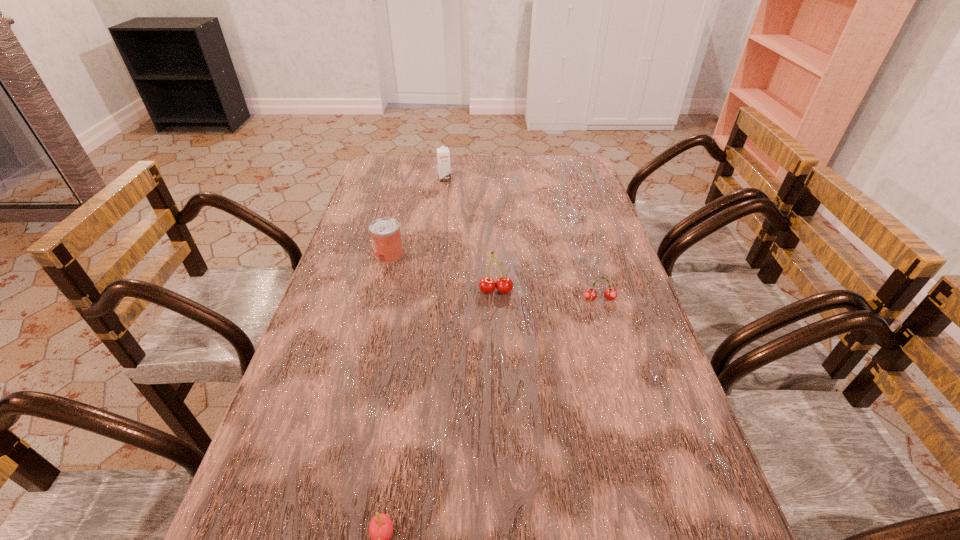
Find the location of a particular element. chocolate milk is located at coordinates (443, 155).

Locate an element on the screen. The width and height of the screenshot is (960, 540). the fourth object from left to right is located at coordinates (504, 285).

At what (x,y) coordinates should I click in order to perform the action: click on the second cherry from left to right. Please return your answer as a coordinate pair (x, y). The width and height of the screenshot is (960, 540). Looking at the image, I should click on (504, 285).

The height and width of the screenshot is (540, 960). Identify the location of the third shortest object. (385, 234).

Find the location of a particular element. Image resolution: width=960 pixels, height=540 pixels. the leftmost object is located at coordinates point(385,234).

This screenshot has width=960, height=540. Find the location of `the rightmost object`. the rightmost object is located at coordinates [x=590, y=294].

Locate an element on the screen. This screenshot has width=960, height=540. the rightmost cherry is located at coordinates (590, 294).

Find the location of a particular element. Image resolution: width=960 pixels, height=540 pixels. vacant area situated 0.060m on the front of the chocolate milk is located at coordinates (444, 191).

Locate an element on the screen. free region located with the stems of the second cherry from left to right pointing upwards is located at coordinates (499, 370).

Locate an element on the screen. vacant space located on the front of the third shortest object is located at coordinates click(x=375, y=309).